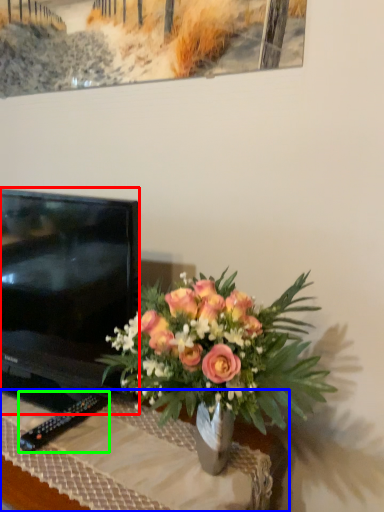
Question: Which object is the farthest from television (highlighted by a red box)? Choose among these: desk (highlighted by a blue box) or remote (highlighted by a green box).

Choices:
 (A) desk
 (B) remote

Answer: (B)